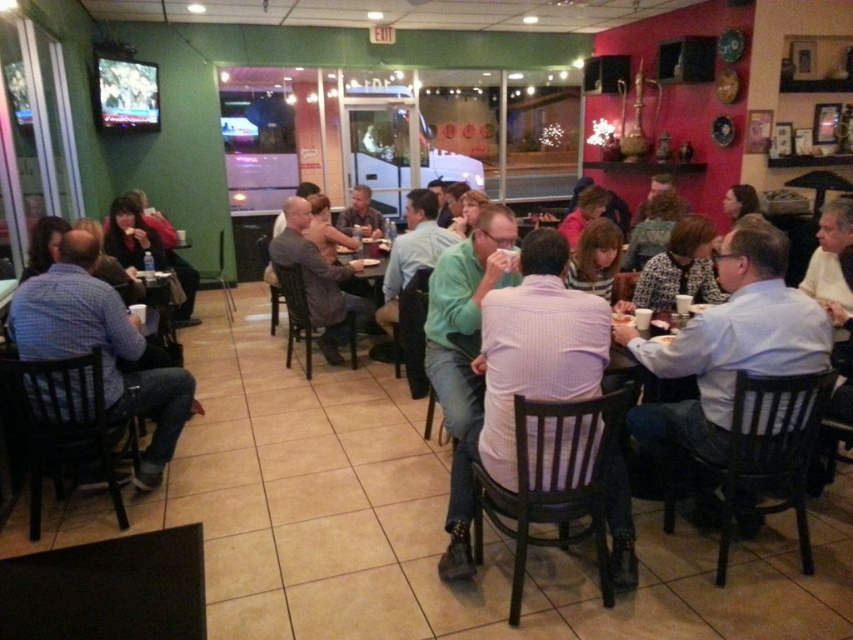
Is point (802, 328) behind point (109, 385)?

No, it is in front of (109, 385).

Looking at this image, between white shirt at center and blue plaid shirt at left, which one is positioned lower?

white shirt at center is below.

Is point (758, 280) positioned behind point (108, 330)?

No, (758, 280) is in front of (108, 330).

Locate an element on the screen. The height and width of the screenshot is (640, 853). white shirt at center is located at coordinates (724, 356).

Is white shirt at center shorter than light brown shirt at center?

Incorrect, white shirt at center's height does not fall short of light brown shirt at center's.

Does white shirt at center come behind light brown shirt at center?

No, white shirt at center is closer to the viewer.

The height and width of the screenshot is (640, 853). What do you see at coordinates (724, 356) in the screenshot?
I see `white shirt at center` at bounding box center [724, 356].

This screenshot has width=853, height=640. Identify the location of white shirt at center. (724, 356).

Can you confirm if blue plaid shirt at left is bigger than light brown shirt at center?

Yes.

Which is in front, point (126, 380) or point (357, 196)?

Point (126, 380)

Image resolution: width=853 pixels, height=640 pixels. Find the location of `blue plaid shirt at left`. blue plaid shirt at left is located at coordinates (102, 346).